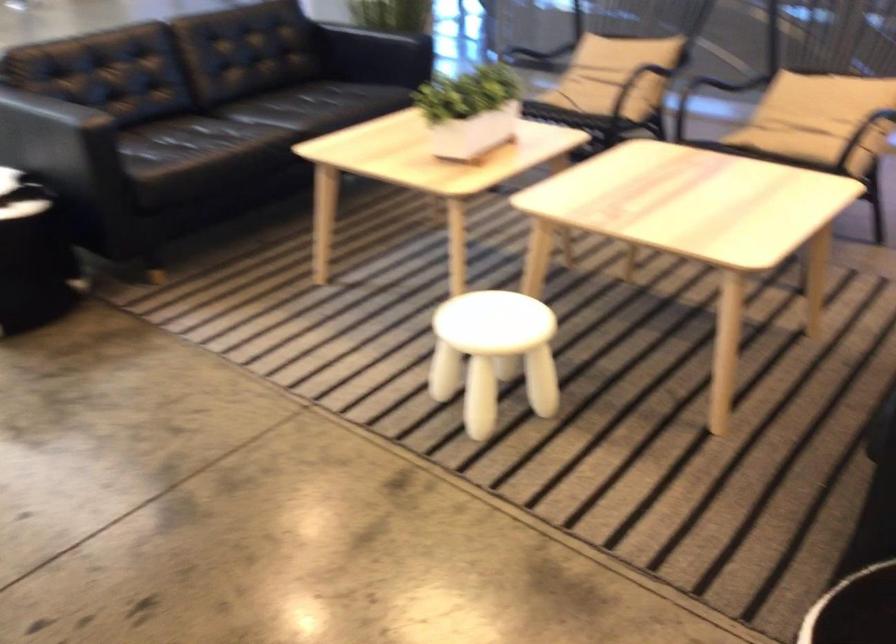
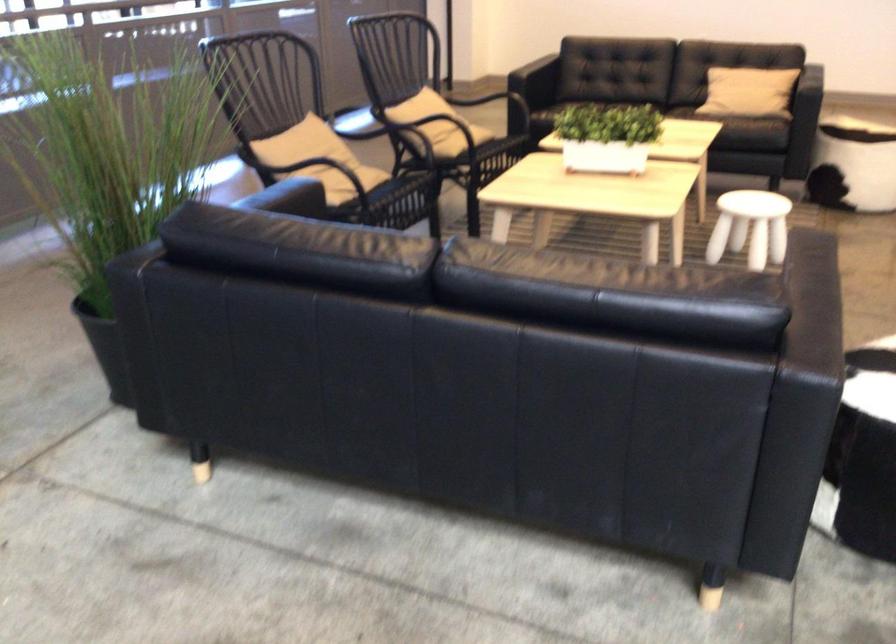
Find the pixel in the second image that matches (x=786, y=84) in the first image.

(431, 111)